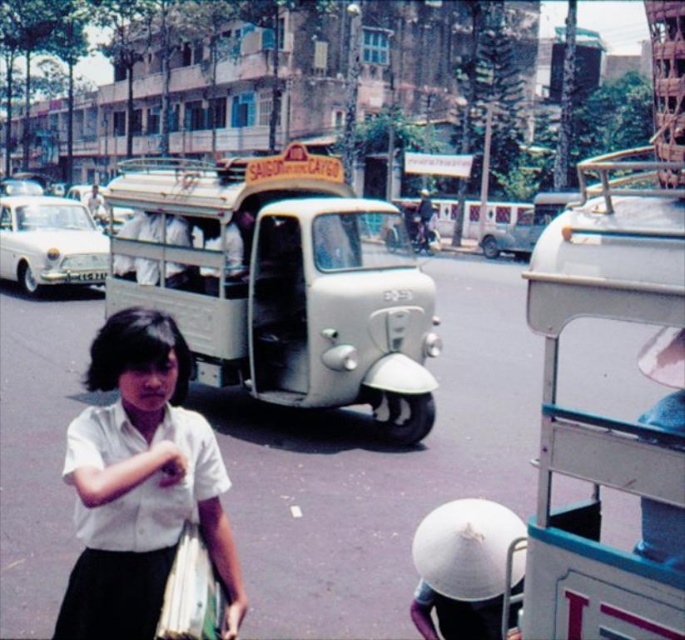
You are a photographer trying to capture the woman in the white cotton blouse at center and the white glossy car at left in a single frame. Which object should you focus on first to ensure both are in the frame?

The white cotton blouse at center is bigger than the white glossy car at left, so you should focus on the white glossy car at left first to ensure both fit within the frame.

You are a photographer standing in the scene and want to take a photo of the white cotton blouse at center and the white glossy car at left. From your position, which object is positioned to the right?

The white cotton blouse at center is positioned to the right of the white glossy car at left.

You are a photographer standing in the scene and want to capture both the white cotton blouse at center and the white glossy car at left in your shot. Which object should you focus on first to ensure it appears larger in the photo?

The white cotton blouse at center is taller than the white glossy car at left, so you should focus on the white cotton blouse at center first to ensure it appears larger in the photo.